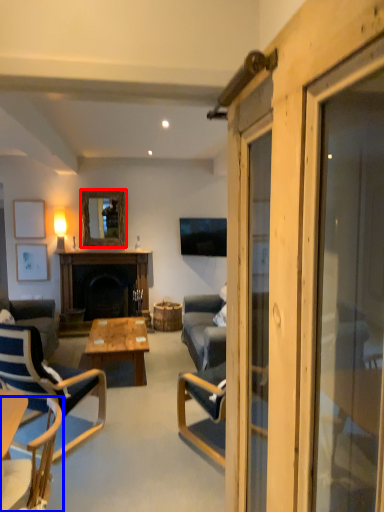
Question: Which object is further to the camera taking this photo, mirror (highlighted by a red box) or chair (highlighted by a blue box)?

Choices:
 (A) mirror
 (B) chair

Answer: (A)